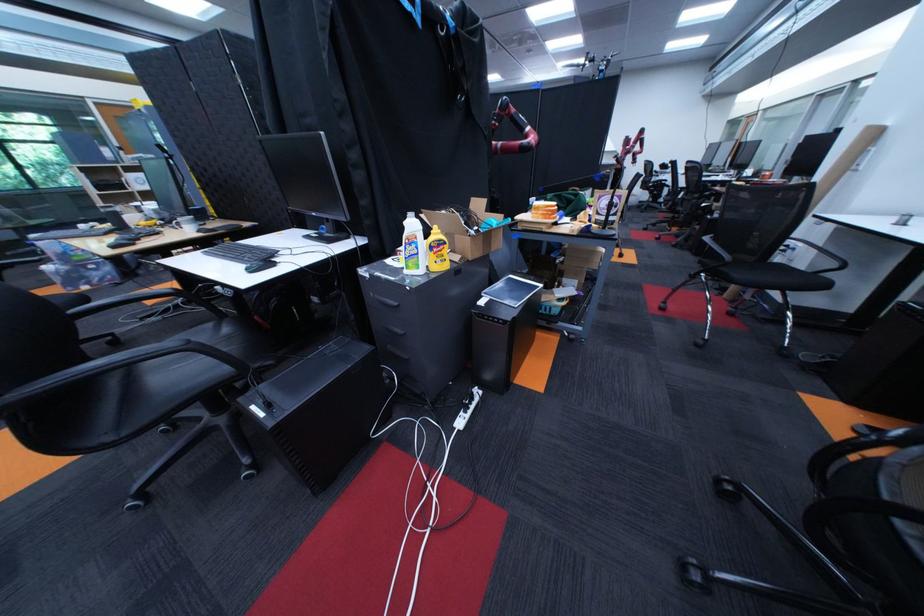
Find the location of a particular element. power strip switch is located at coordinates (458, 424).